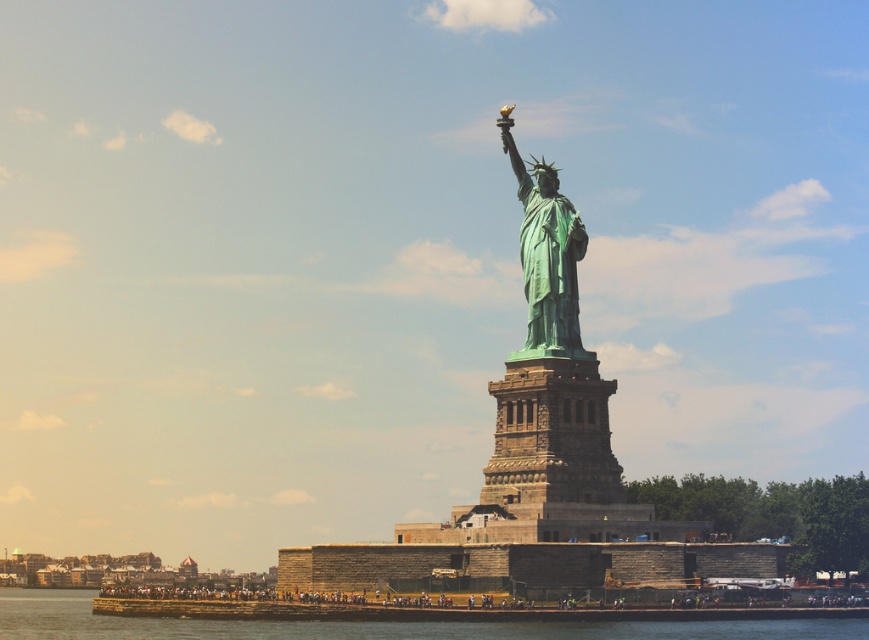
Question: Does green patina water at lower center lie behind green patina statue at center?

Choices:
 (A) no
 (B) yes

Answer: (A)

Question: Can you confirm if green patina water at lower center is wider than green patina statue at center?

Choices:
 (A) no
 (B) yes

Answer: (B)

Question: Can you confirm if green patina water at lower center is thinner than green patina statue at center?

Choices:
 (A) no
 (B) yes

Answer: (A)